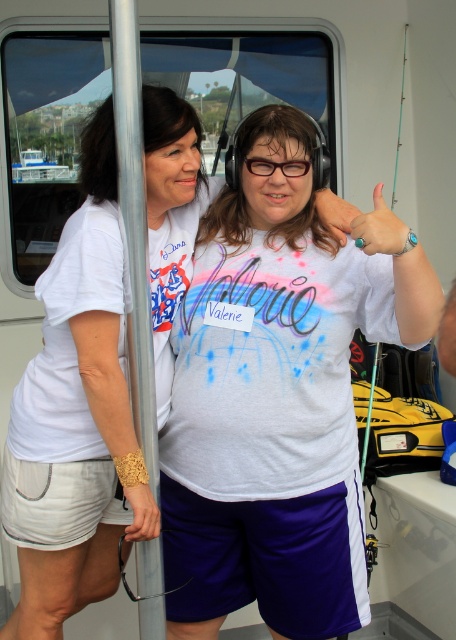
Who is positioned more to the right, white matte t-shirt at center or teal painted fingernails at upper center?

From the viewer's perspective, teal painted fingernails at upper center appears more on the right side.

Based on the photo, is white matte t-shirt at center above teal painted fingernails at upper center?

No.

You are a GUI agent. You are given a task and a screenshot of the screen. Output one action in this format:
    pyautogui.click(x=<x>, y=<y>)
    Task: Click on the white matte t-shirt at center
    This screenshot has width=456, height=640.
    Given the screenshot: What is the action you would take?
    pyautogui.click(x=62, y=582)

Where is `white matte t-shirt at center`? The image size is (456, 640). white matte t-shirt at center is located at coordinates (62, 582).

Does purple athletic shorts at center come behind teal matte ring at upper center?

That is True.

Is point (296, 518) positioned before point (328, 228)?

No, (296, 518) is further to viewer.

You are a GUI agent. You are given a task and a screenshot of the screen. Output one action in this format:
    pyautogui.click(x=<x>, y=<y>)
    Task: Click on the purple athletic shorts at center
    This screenshot has height=640, width=456.
    Given the screenshot: What is the action you would take?
    pyautogui.click(x=268, y=557)

Does white fabric shirt at center have a larger size compared to white matte t-shirt at center?

No, white fabric shirt at center is not bigger than white matte t-shirt at center.

Does white fabric shirt at center have a lesser width compared to white matte t-shirt at center?

Incorrect, white fabric shirt at center's width is not less than white matte t-shirt at center's.

What are the coordinates of `white fabric shirt at center` in the screenshot? It's located at [x=274, y=397].

I want to click on white fabric shirt at center, so point(274,397).